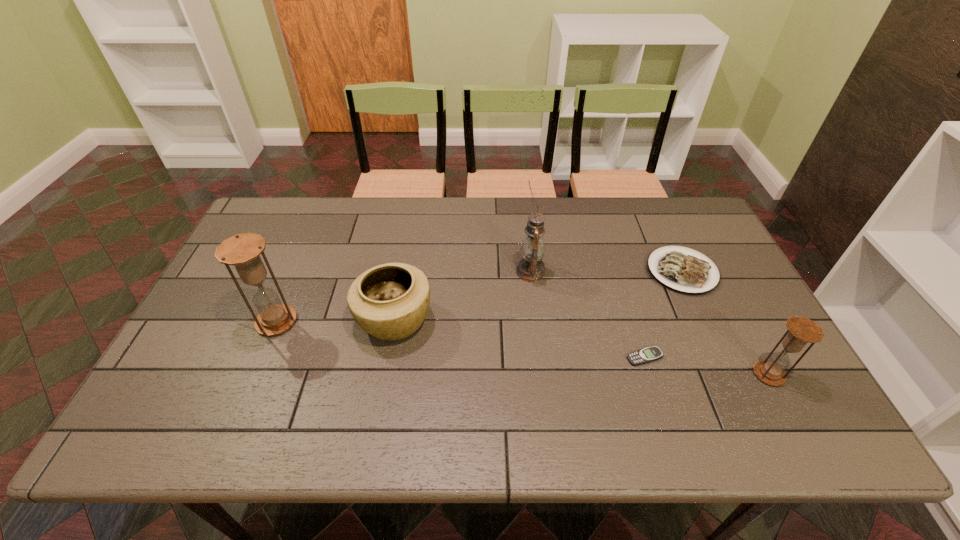
To make them evenly spaced by inserting another hourglass among them, please locate a vacant spot for this new hourglass. Please provide its 2D coordinates. Your answer should be formatted as a tuple, i.e. [(x, y)], where the tuple contains the x and y coordinates of a point satisfying the conditions above.

[(510, 347)]